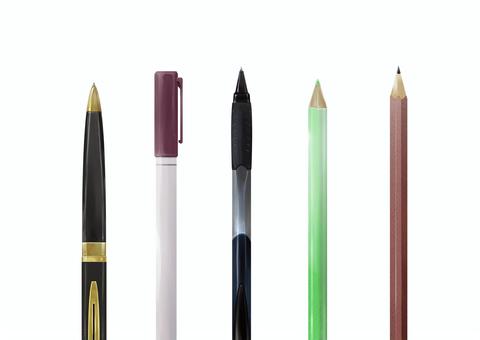
I want to click on writing tools, so click(x=92, y=228), click(x=177, y=210), click(x=246, y=195), click(x=311, y=262), click(x=391, y=230).